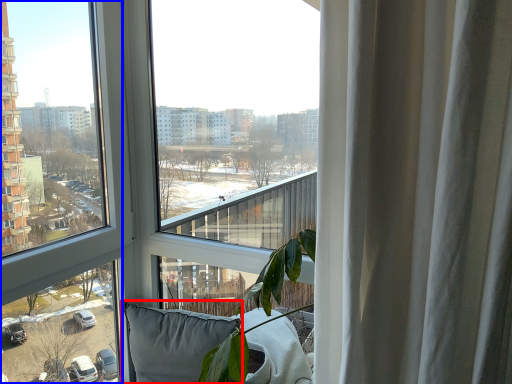
Question: Which of the following is the closest to the observer, pillow (highlighted by a red box) or window (highlighted by a blue box)?

Choices:
 (A) pillow
 (B) window

Answer: (B)